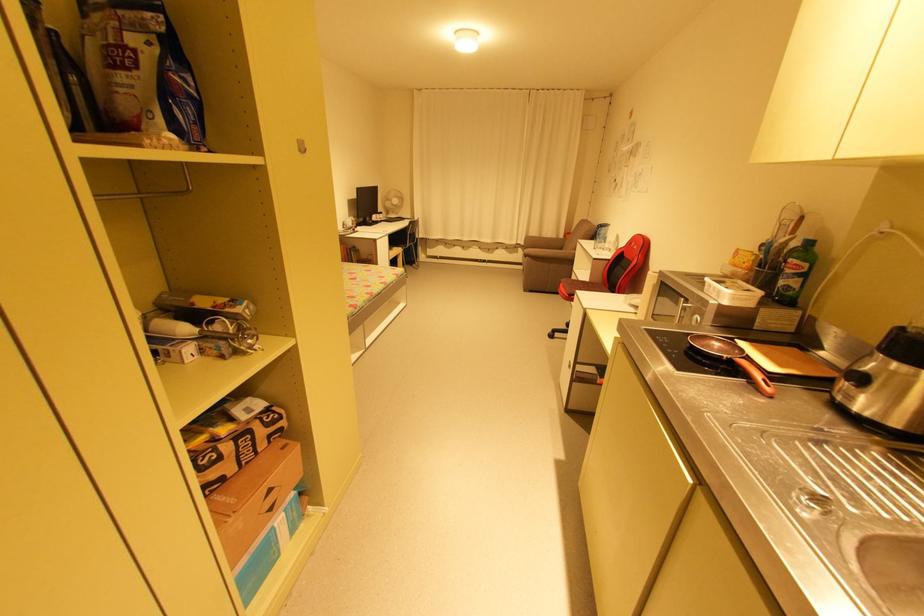
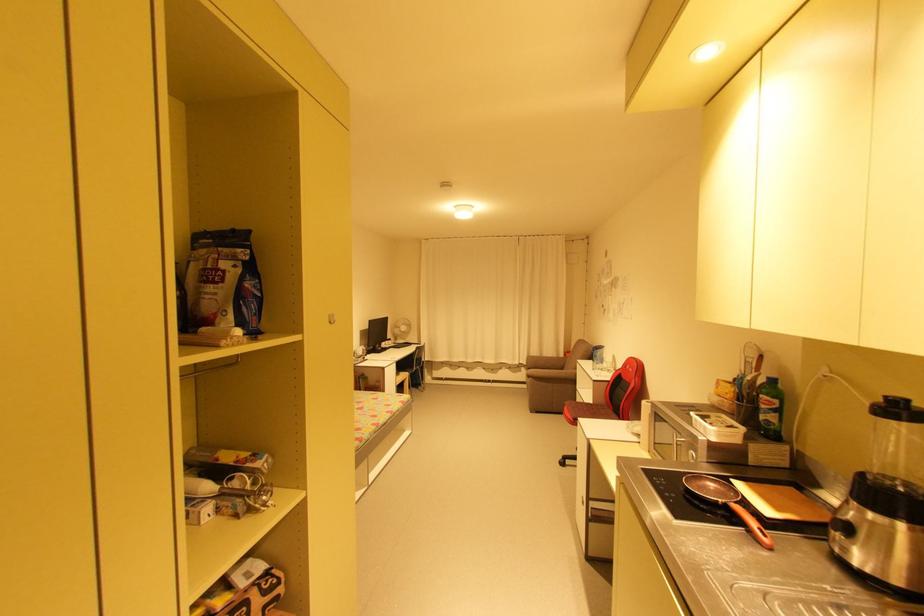
Where in the second image is the point corresponding to point (800, 270) from the first image?

(773, 406)